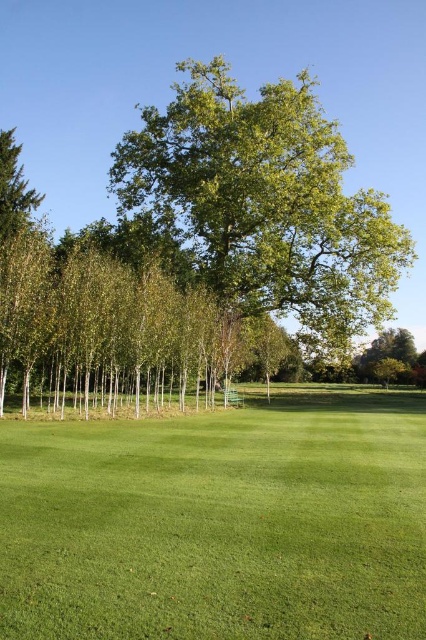
Question: Is green grass at lower center to the left of green leafy tree at center from the viewer's perspective?

Choices:
 (A) no
 (B) yes

Answer: (B)

Question: Is green grass at lower center positioned behind green leafy tree at center?

Choices:
 (A) no
 (B) yes

Answer: (A)

Question: Is green grass at lower center further to the viewer compared to green leafy tree at center?

Choices:
 (A) yes
 (B) no

Answer: (B)

Question: Among these points, which one is nearest to the camera?

Choices:
 (A) (241, 518)
 (B) (247, 108)

Answer: (A)